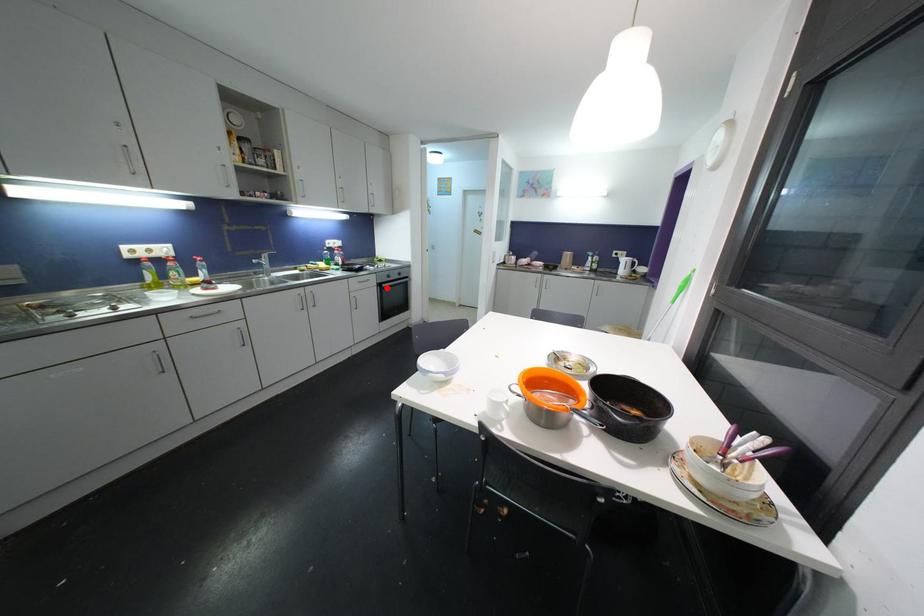
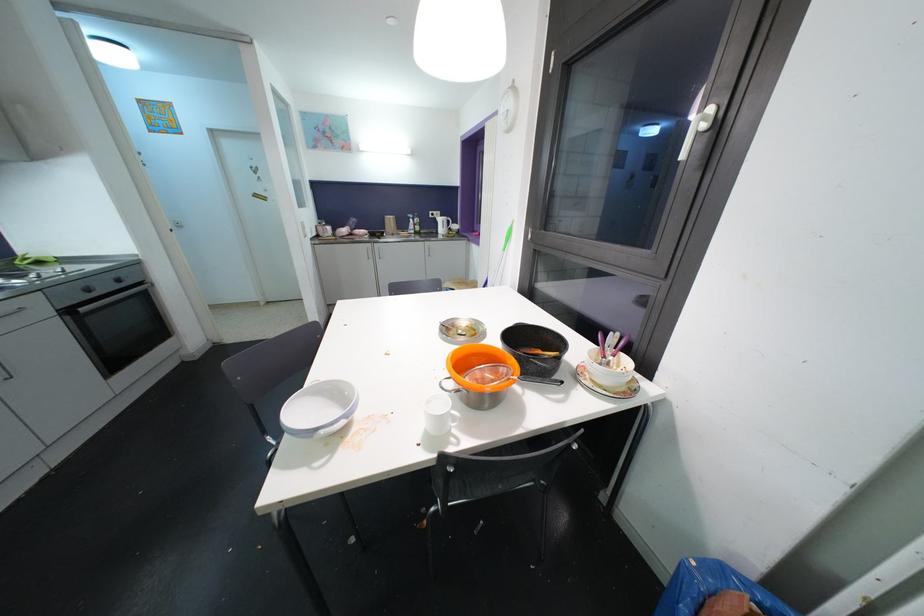
Locate, in the second image, the point that corresponds to the highlighted location in the first image.

(84, 312)